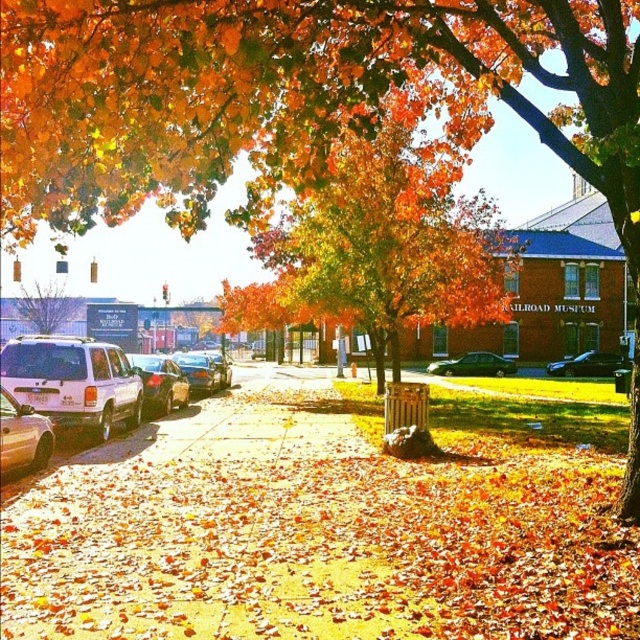
You are a delivery person who needs to park your 2.5 meter wide vehicle. You see a white matte suv at left and a shiny silver sedan at left. Which vehicle takes up more space in the parking spot?

The white matte suv at left has a larger size compared to shiny silver sedan at left, so it takes up more space in the parking spot.

You are a delivery person who needs to load a large package into a vehicle. The package is 2 meters tall. Which vehicle between the white matte suv at left and the shiny silver sedan at left can accommodate the package based on their height?

The white matte suv at left has a greater height compared to the shiny silver sedan at left, so the large package that is 2 meters tall can be accommodated in the white matte suv at left.